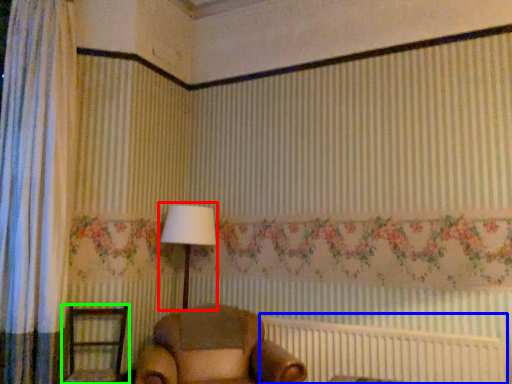
Question: Estimate the real-world distances between objects in this image. Which object is farther from table lamp (highlighted by a red box), bed frame (highlighted by a blue box) or furniture (highlighted by a green box)?

Choices:
 (A) bed frame
 (B) furniture

Answer: (A)